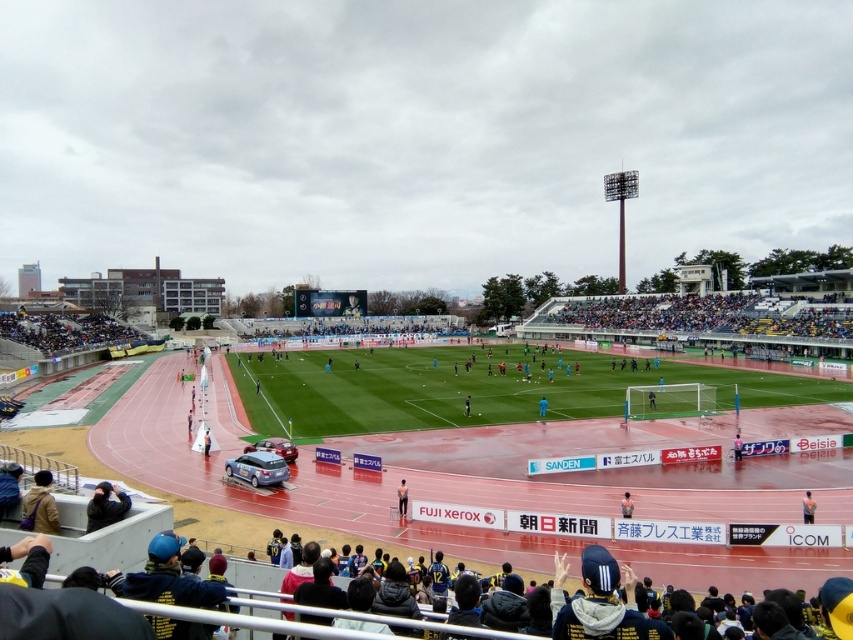
You are a photographer standing at the edge of the soccer field. You want to take a photo that includes both the point at coordinates point (30, 490) and point (276, 474). Which point will appear larger in your photo?

Point (30, 490) is closer to the camera than point (276, 474), so it will appear larger in the photo.

You are a photographer positioned at the edge of the soccer field. You want to capture a photo that includes both the white fabric flag at center and the blue fabric person at center. Based on their positions, which object should appear lower in the photo?

The white fabric flag at center is located below the blue fabric person at center, so in the photo, the white fabric flag at center will appear lower than the blue fabric person at center.

You are a photographer positioned at the edge of the soccer field. You need to capture a photo of both the brown leather jacket at lower left and the satin silver car at lower center in the same frame. Considering their sizes, which object will appear smaller in the final photo?

The brown leather jacket at lower left will appear smaller in the photo because it has a lesser width compared to the satin silver car at lower center.